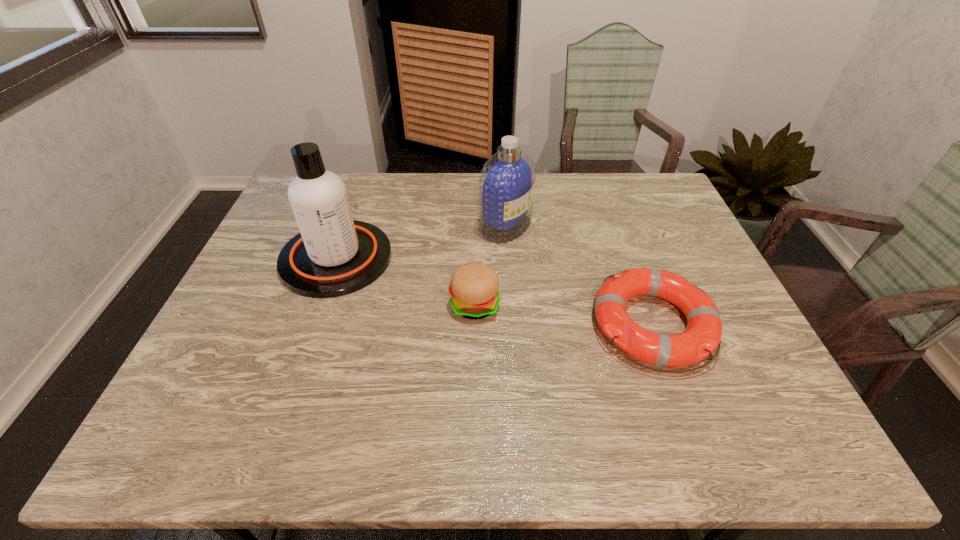
The image size is (960, 540). What are the coordinates of `vacant space that satisfies the following two spatial constraints: 1. on the back side of the right cleansing agent; 2. on the left side of the third tallest object` in the screenshot? It's located at (475, 226).